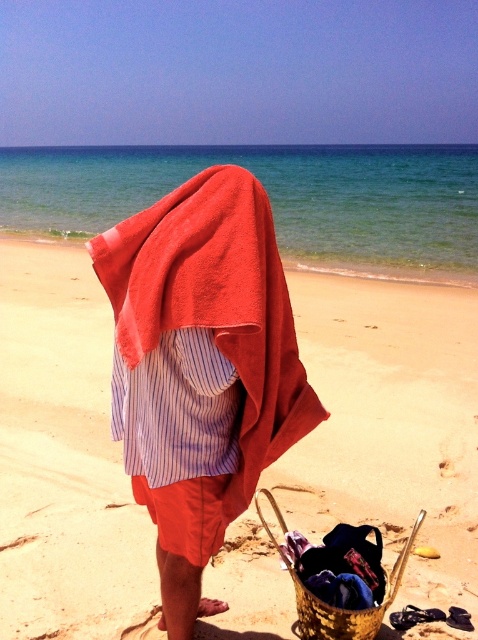
Who is taller, red towel at center or gold woven basket at lower center?

red towel at center

Who is higher up, red towel at center or gold woven basket at lower center?

red towel at center

Is point (156, 282) closer to camera compared to point (329, 618)?

That is True.

In order to click on red towel at center in this screenshot , I will do `click(201, 369)`.

Is sandy beach at center smaller than gold woven basket at lower center?

Incorrect, sandy beach at center is not smaller in size than gold woven basket at lower center.

Does sandy beach at center have a lesser width compared to gold woven basket at lower center?

No.

Is point (388, 301) in front of point (393, 580)?

That is False.

This screenshot has width=478, height=640. I want to click on sandy beach at center, so click(x=391, y=426).

Who is higher up, sandy beach at center or red towel at center?

sandy beach at center is higher up.

Between sandy beach at center and red towel at center, which one appears on the right side from the viewer's perspective?

Positioned to the right is sandy beach at center.

Where is `sandy beach at center`? This screenshot has height=640, width=478. sandy beach at center is located at coordinates (391, 426).